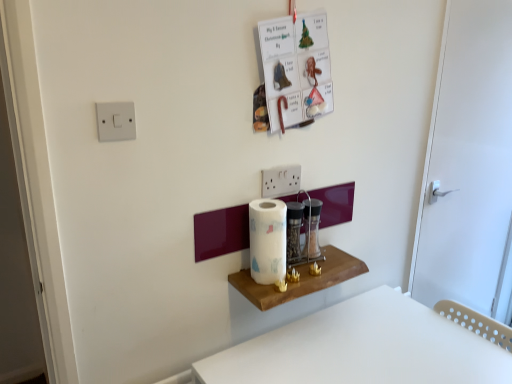
Question: In terms of width, does white matte door at right look wider or thinner when compared to white plastic table at lower right?

Choices:
 (A) wide
 (B) thin

Answer: (B)

Question: Is white matte door at right spatially inside white plastic table at lower right, or outside of it?

Choices:
 (A) outside
 (B) inside

Answer: (A)

Question: Which is nearer to the white plastic light switch at upper left?

Choices:
 (A) wooden shelf at center
 (B) white matte door at right
 (C) white glossy paper towel at center
 (D) white plastic table at lower right

Answer: (C)

Question: Estimate the real-world distances between objects in this image. Which object is farther from the wooden shelf at center?

Choices:
 (A) white glossy paper towel at center
 (B) white plastic table at lower right
 (C) white matte door at right
 (D) white plastic light switch at upper left

Answer: (C)